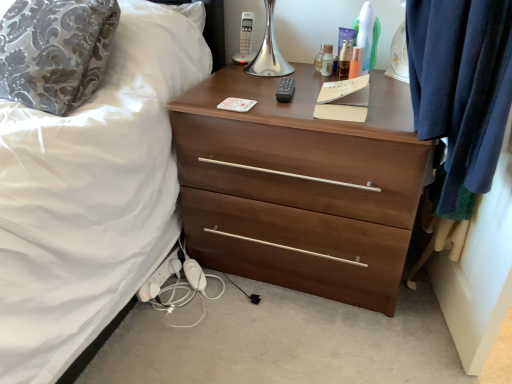
You are a GUI agent. You are given a task and a screenshot of the screen. Output one action in this format:
    pyautogui.click(x=<x>, y=<y>)
    Task: Click on the vacant point to the left of translucent plastic bottles at upper right, which is the 2th toiletry in right-to-left order
    The height and width of the screenshot is (384, 512).
    Given the screenshot: What is the action you would take?
    pyautogui.click(x=293, y=81)